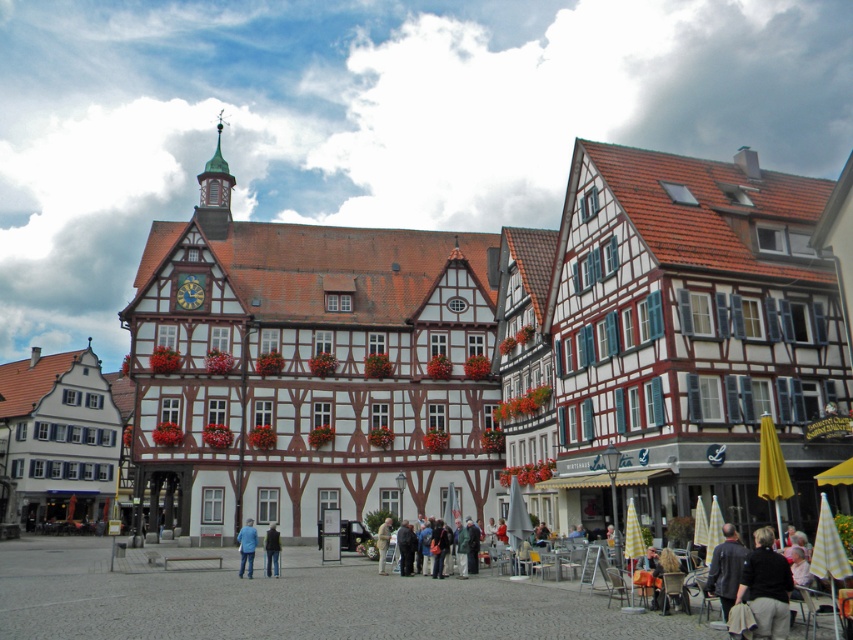
Does dark gray fabric jacket at lower right have a lesser height compared to blue denim jeans at center?

Yes.

Who is higher up, dark gray fabric jacket at lower right or blue denim jeans at center?

dark gray fabric jacket at lower right is above.

Between point (782, 616) and point (241, 529), which one is positioned behind?

Point (241, 529)

Locate an element on the screen. dark gray fabric jacket at lower right is located at coordinates (766, 586).

Does dark gray fabric jacket at lower right appear on the left side of dark blue jacket at center?

Incorrect, dark gray fabric jacket at lower right is not on the left side of dark blue jacket at center.

Where is `dark gray fabric jacket at lower right`? The image size is (853, 640). dark gray fabric jacket at lower right is located at coordinates (766, 586).

I want to click on dark gray fabric jacket at lower right, so click(766, 586).

Who is more forward, [244,561] or [265,538]?

Positioned in front is point [244,561].

Which is in front, point (248, 529) or point (270, 544)?

Positioned in front is point (270, 544).

Find the location of a particular element. The image size is (853, 640). blue denim jeans at center is located at coordinates (247, 547).